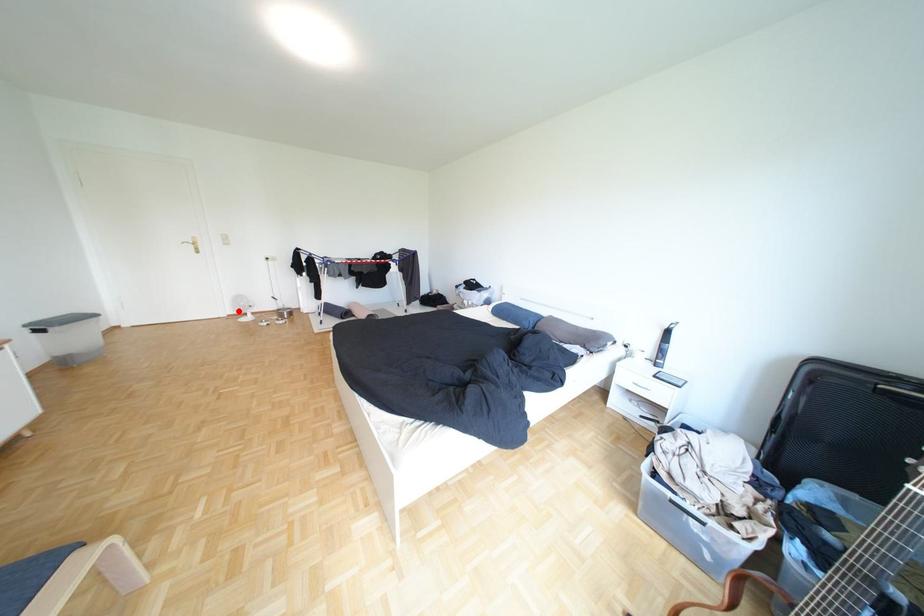
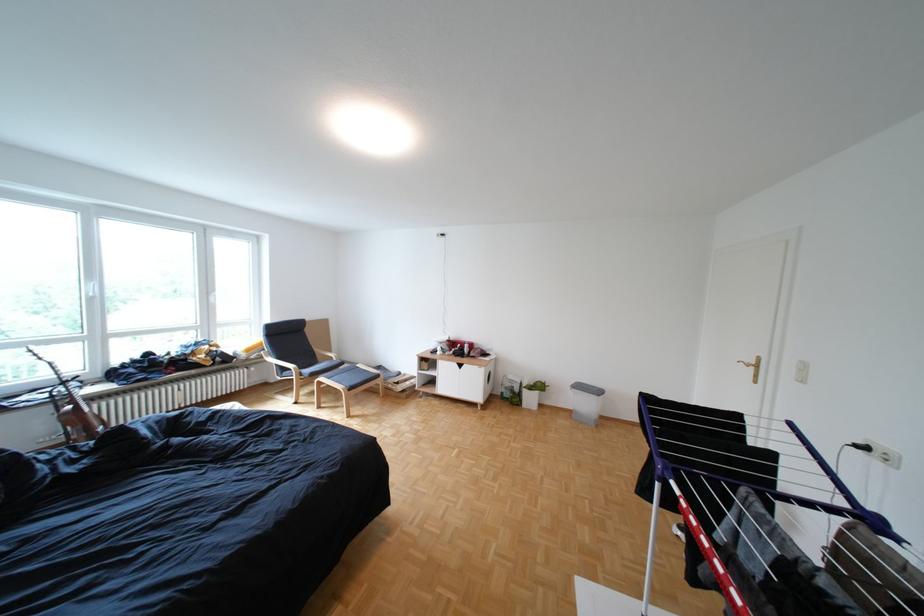
Question: I am providing you with two images of the same scene from different viewpoints. A red point is marked on the first image. Can you still see the location of the red point in image 2?

Choices:
 (A) Yes
 (B) No

Answer: (B)